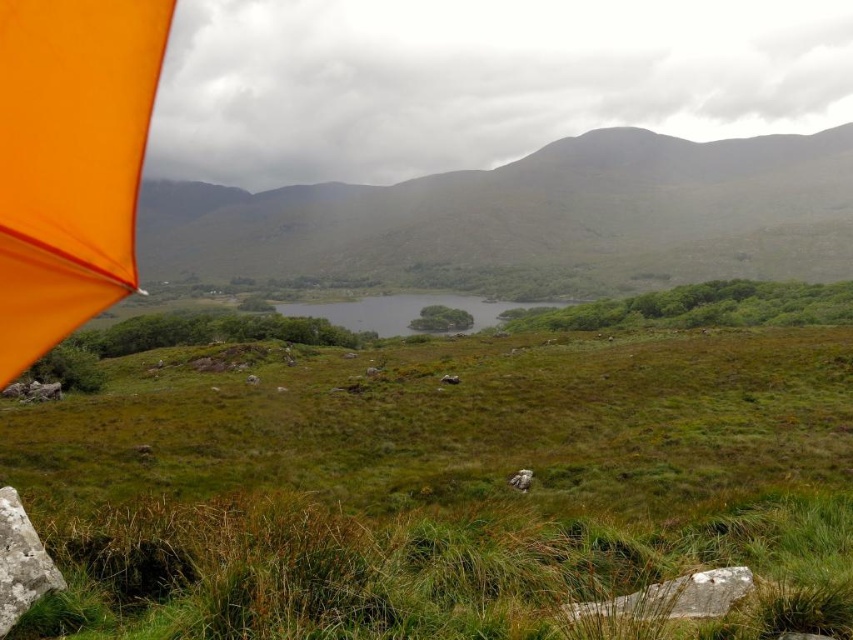
Between green grassy hillside at center and orange fabric umbrella at upper left, which one has more height?

green grassy hillside at center

Is point (352, 188) farther from camera compared to point (38, 216)?

Yes, it is.

This screenshot has width=853, height=640. In order to click on green grassy hillside at center in this screenshot , I will do `click(532, 216)`.

Is green grassy field at center above green grassy lake at center?

Incorrect, green grassy field at center is not positioned above green grassy lake at center.

Does green grassy field at center come behind green grassy lake at center?

No, green grassy field at center is in front of green grassy lake at center.

Does point (259, 625) come behind point (498, 314)?

No, it is not.

Image resolution: width=853 pixels, height=640 pixels. Find the location of `green grassy field at center`. green grassy field at center is located at coordinates (445, 488).

Between green grassy field at center and orange fabric umbrella at upper left, which one appears on the left side from the viewer's perspective?

Positioned to the left is orange fabric umbrella at upper left.

Does green grassy field at center appear on the left side of orange fabric umbrella at upper left?

No, green grassy field at center is not to the left of orange fabric umbrella at upper left.

Between point (444, 536) and point (16, 269), which one is positioned in front?

Point (16, 269) is in front.

Locate an element on the screen. The height and width of the screenshot is (640, 853). green grassy field at center is located at coordinates (445, 488).